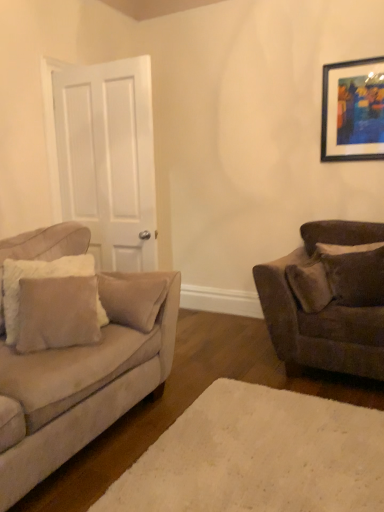
Question: Is white plush rug at lower center taller than wooden-framed artwork at upper right?

Choices:
 (A) no
 (B) yes

Answer: (A)

Question: Does white plush rug at lower center have a larger size compared to wooden-framed artwork at upper right?

Choices:
 (A) no
 (B) yes

Answer: (B)

Question: Is white plush rug at lower center positioned far away from wooden-framed artwork at upper right?

Choices:
 (A) no
 (B) yes

Answer: (B)

Question: Can we say white plush rug at lower center lies outside wooden-framed artwork at upper right?

Choices:
 (A) no
 (B) yes

Answer: (B)

Question: Considering the relative positions of white plush rug at lower center and wooden-framed artwork at upper right in the image provided, is white plush rug at lower center to the right of wooden-framed artwork at upper right from the viewer's perspective?

Choices:
 (A) yes
 (B) no

Answer: (B)

Question: From a real-world perspective, is white plush rug at lower center positioned above or below beige fabric pillow at left, the 1th pillow in the left-to-right sequence?

Choices:
 (A) above
 (B) below

Answer: (B)

Question: Considering the positions of point (206, 445) and point (100, 307), is point (206, 445) closer or farther from the camera than point (100, 307)?

Choices:
 (A) closer
 (B) farther

Answer: (A)

Question: From their relative heights in the image, would you say white plush rug at lower center is taller or shorter than beige fabric pillow at left, the 1th pillow in the left-to-right sequence?

Choices:
 (A) tall
 (B) short

Answer: (B)

Question: From the image's perspective, is white plush rug at lower center above or below beige fabric pillow at left, positioned as the second pillow in back-to-front order?

Choices:
 (A) above
 (B) below

Answer: (B)

Question: In terms of width, does suede-like brown pillow at right, the 2th pillow when ordered from left to right, look wider or thinner when compared to white matte door at left?

Choices:
 (A) thin
 (B) wide

Answer: (B)

Question: From the image's perspective, is suede-like brown pillow at right, the second pillow positioned from the front, located above or below white matte door at left?

Choices:
 (A) below
 (B) above

Answer: (A)

Question: Is suede-like brown pillow at right, acting as the 1th pillow starting from the back, inside or outside of white matte door at left?

Choices:
 (A) inside
 (B) outside

Answer: (B)

Question: Based on their sizes in the image, would you say suede-like brown pillow at right, which is counted as the 1th pillow, starting from the right, is bigger or smaller than white matte door at left?

Choices:
 (A) big
 (B) small

Answer: (B)

Question: Considering the positions of velvet brown couch at right, the 2th studio couch from the left, and white matte door at left in the image, is velvet brown couch at right, the 2th studio couch from the left, wider or thinner than white matte door at left?

Choices:
 (A) thin
 (B) wide

Answer: (B)

Question: Is velvet brown couch at right, the 2th studio couch from the left, to the left or to the right of white matte door at left in the image?

Choices:
 (A) left
 (B) right

Answer: (B)